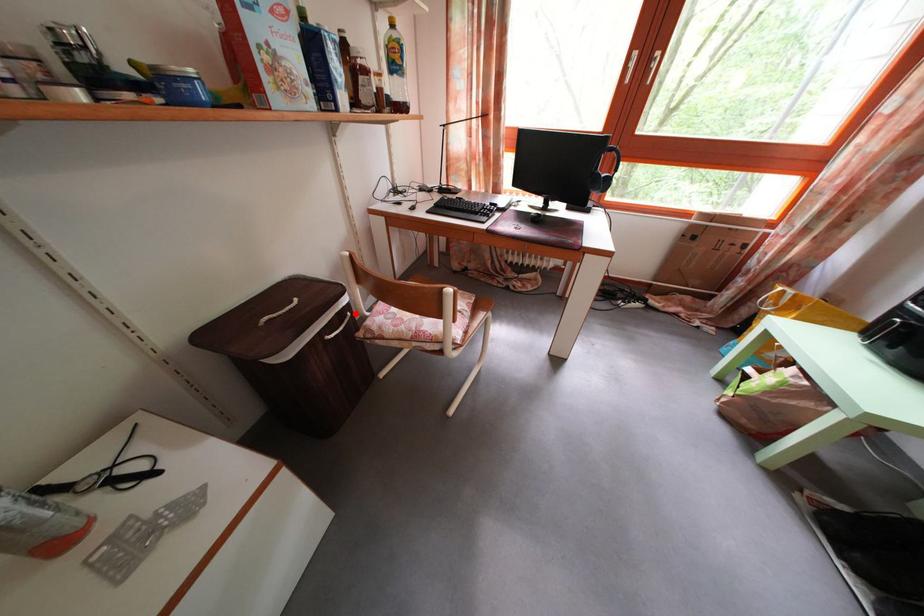
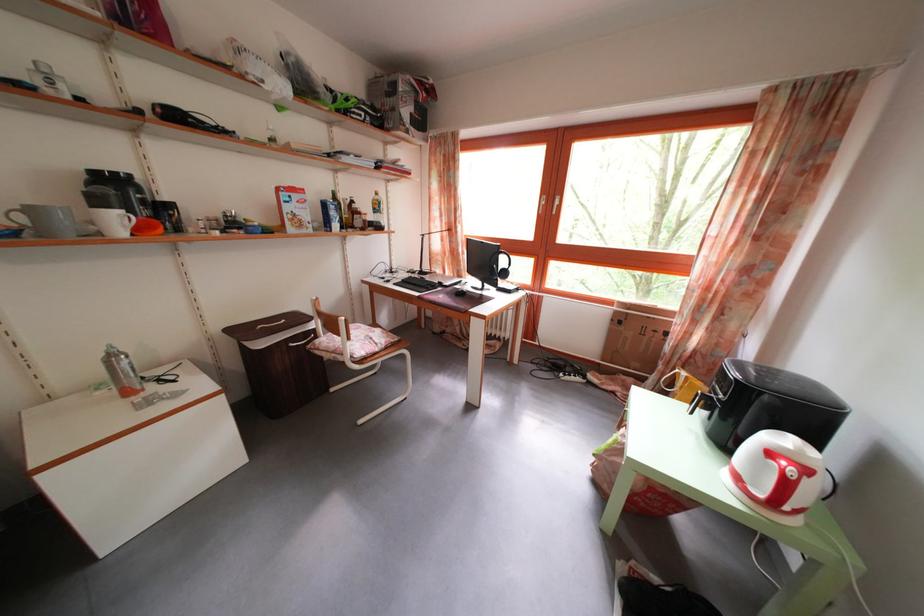
Where in the second image is the point corresponding to the highlighted location from the first image?

(322, 339)